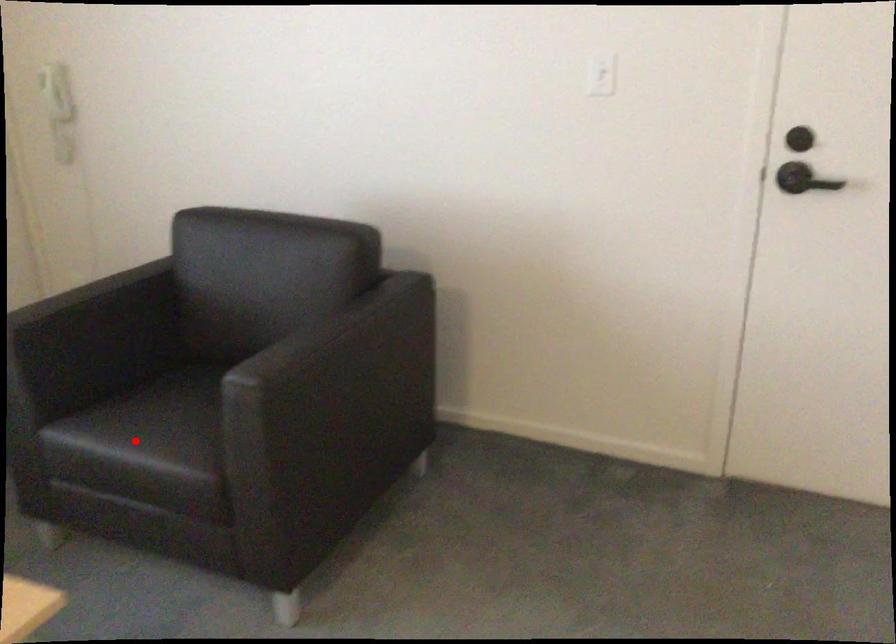
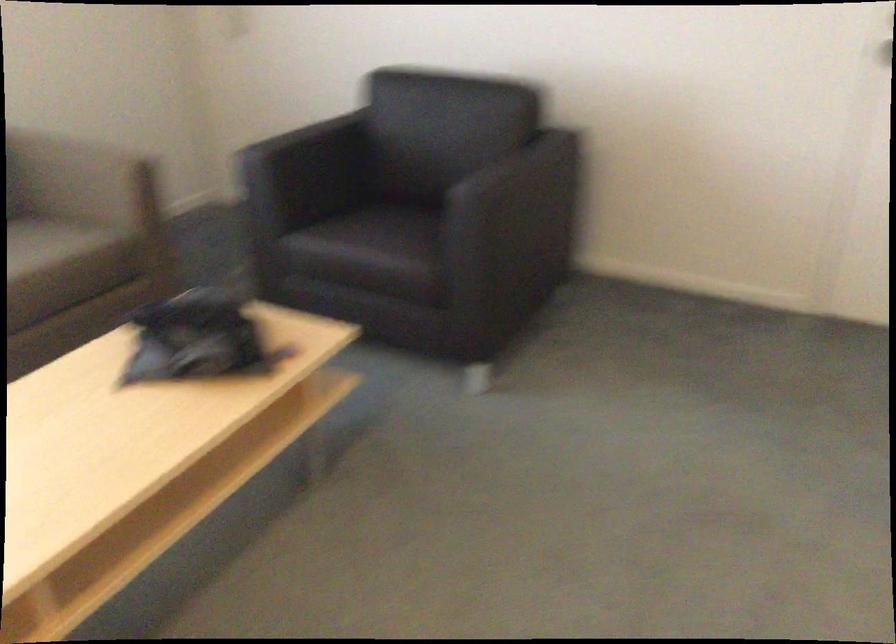
Locate, in the second image, the point that corresponds to the highlighted location in the first image.

(368, 240)